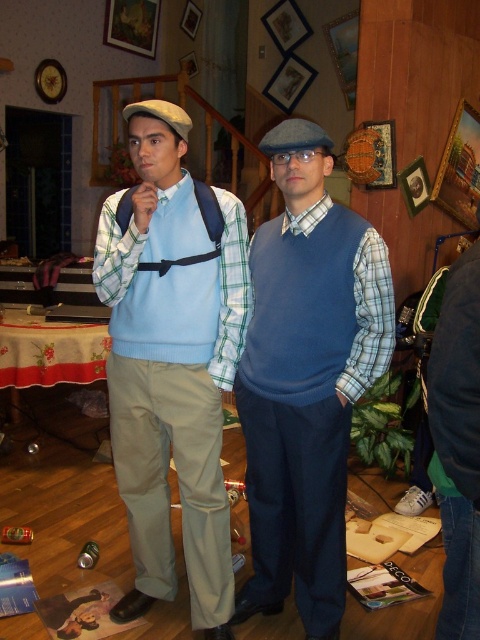
Can you confirm if matte blue fabric suspenders at center is positioned above blue wool sweater vest at center?

Yes.

This screenshot has width=480, height=640. What do you see at coordinates (171, 364) in the screenshot? I see `matte blue fabric suspenders at center` at bounding box center [171, 364].

Identify the location of matte blue fabric suspenders at center. (171, 364).